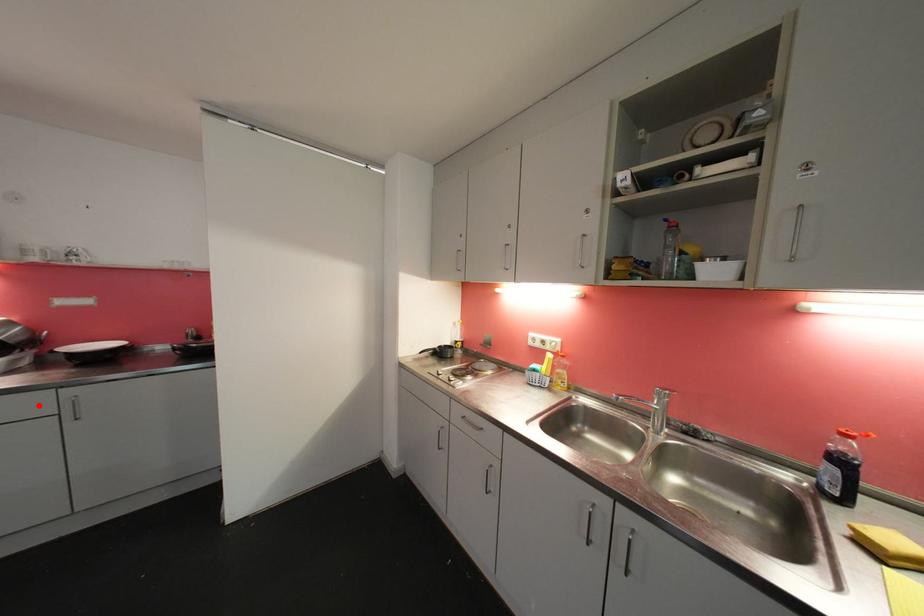
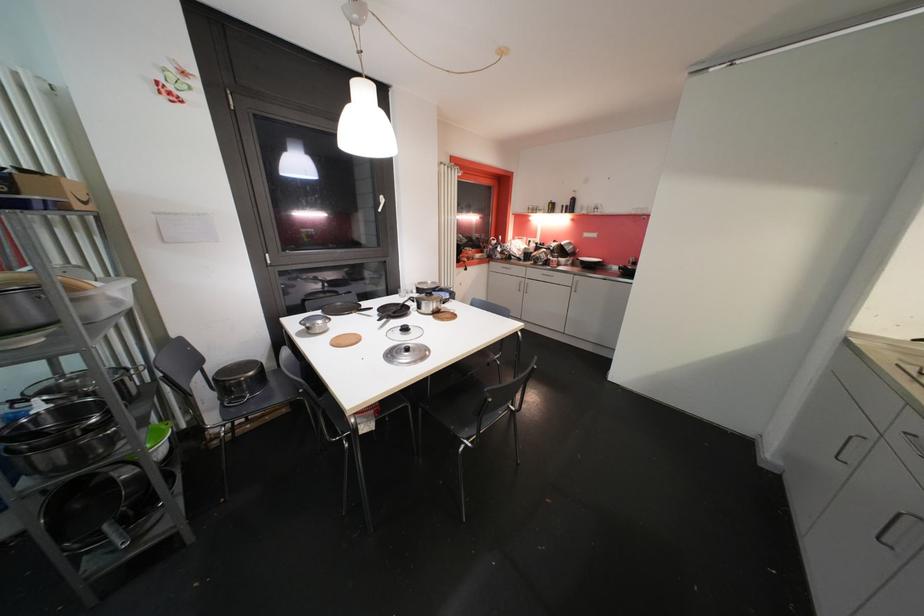
Question: A red point is marked in image1. In image2, is the corresponding 3D point closer to the camera or farther? Reply with the corresponding letter.

Choices:
 (A) The corresponding 3D point is closer.
 (B) The corresponding 3D point is farther.

Answer: (B)